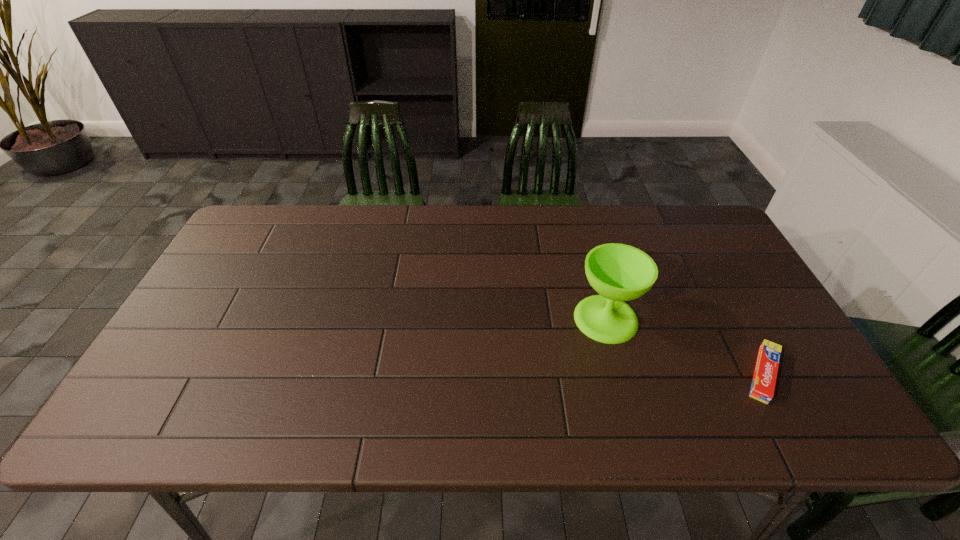
The width and height of the screenshot is (960, 540). Find the location of `vacant space at the near edge of the desktop`. vacant space at the near edge of the desktop is located at coordinates (684, 426).

Where is `vacant region at the left edge of the desktop`? The width and height of the screenshot is (960, 540). vacant region at the left edge of the desktop is located at coordinates (246, 300).

Where is `vacant space at the right edge of the desktop`? vacant space at the right edge of the desktop is located at coordinates (752, 318).

In the image, there is a desktop. Where is `vacant area at the far left corner`? vacant area at the far left corner is located at coordinates (281, 237).

Where is `vacant area at the near left corner of the desktop`? vacant area at the near left corner of the desktop is located at coordinates (188, 406).

At what (x,y) coordinates should I click in order to perform the action: click on vacant space at the near right corner. Please return your answer as a coordinate pair (x, y). Looking at the image, I should click on (804, 431).

You are a GUI agent. You are given a task and a screenshot of the screen. Output one action in this format:
    pyautogui.click(x=<x>, y=<y>)
    Task: Click on the blank space that satisfies the following two spatial constraints: 1. on the front side of the right object; 2. on the right side of the wineglass
    The width and height of the screenshot is (960, 540).
    Given the screenshot: What is the action you would take?
    pyautogui.click(x=621, y=374)